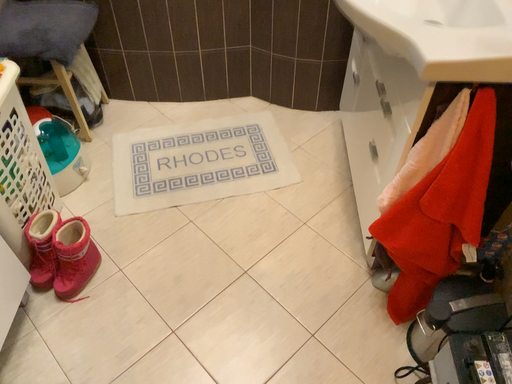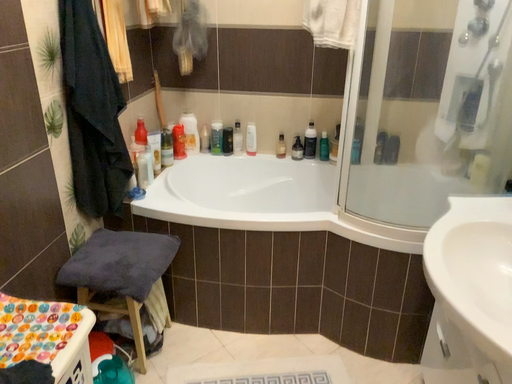
Question: How did the camera likely rotate when shooting the video?

Choices:
 (A) rotated upward
 (B) rotated downward

Answer: (A)